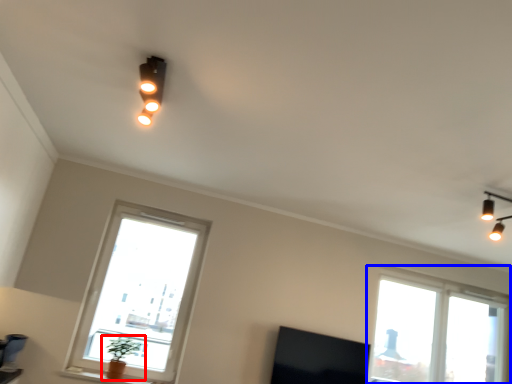
Question: Which object is closer to the camera taking this photo, houseplant (highlighted by a red box) or window (highlighted by a blue box)?

Choices:
 (A) houseplant
 (B) window

Answer: (A)